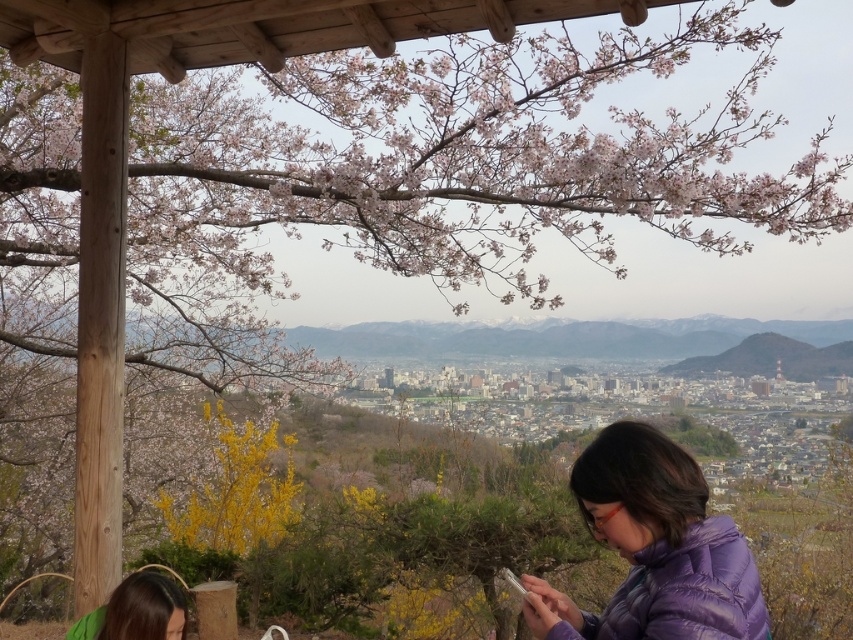
Question: Can you confirm if purple down jacket at lower right is wider than green fabric hair at lower left?

Choices:
 (A) no
 (B) yes

Answer: (B)

Question: Which object appears closest to the camera in this image?

Choices:
 (A) green fabric hair at lower left
 (B) purple down jacket at lower right

Answer: (B)

Question: Which point is closer to the camera taking this photo?

Choices:
 (A) (585, 470)
 (B) (119, 584)

Answer: (A)

Question: Is purple down jacket at lower right behind green fabric hair at lower left?

Choices:
 (A) no
 (B) yes

Answer: (A)

Question: Observing the image, what is the correct spatial positioning of purple down jacket at lower right in reference to green fabric hair at lower left?

Choices:
 (A) below
 (B) above

Answer: (B)